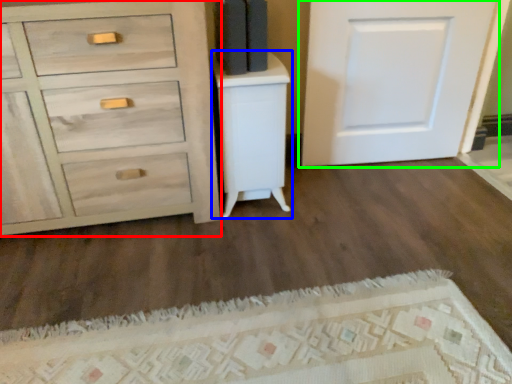
Question: Which object is the farthest from chest of drawers (highlighted by a red box)? Choose among these: vanity (highlighted by a blue box) or door (highlighted by a green box).

Choices:
 (A) vanity
 (B) door

Answer: (B)